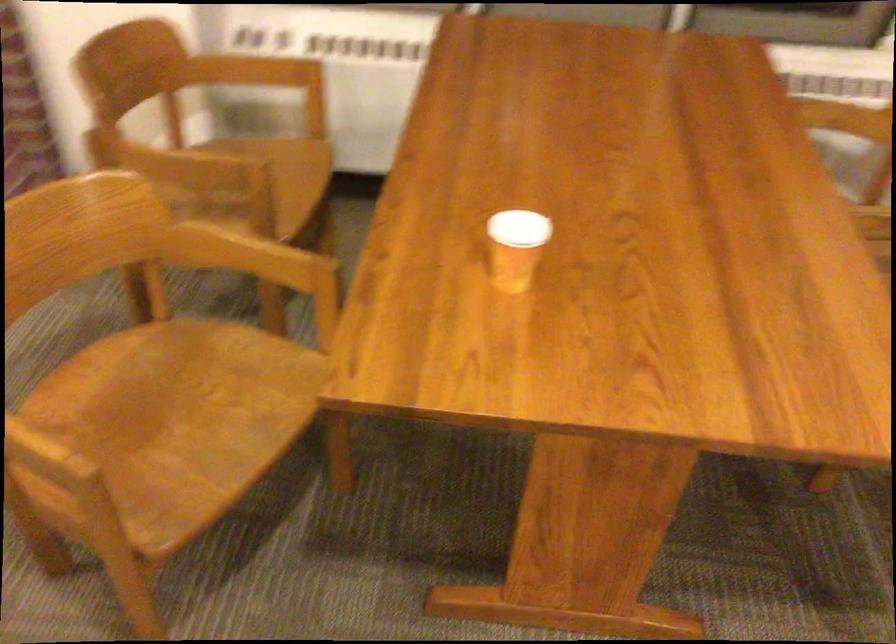
Where would you lift the paper cup? Please return your answer as a coordinate pair (x, y).

(515, 247)